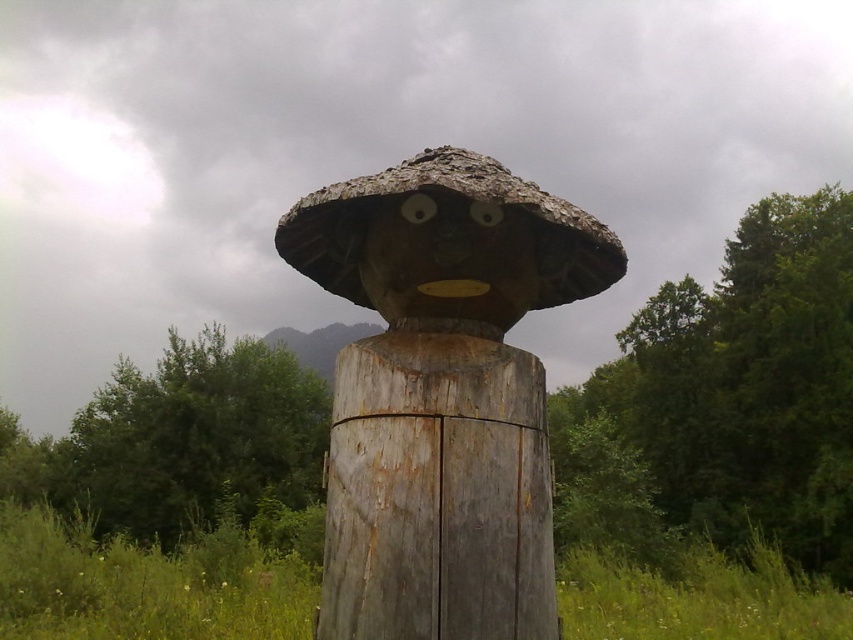
Question: Is rusty wood totem at center bigger than wooden sculpture at center?

Choices:
 (A) no
 (B) yes

Answer: (B)

Question: Which of the following is the farthest from the observer?

Choices:
 (A) (514, 236)
 (B) (496, 170)

Answer: (A)

Question: Which point is closer to the camera?

Choices:
 (A) weathered wood post at center
 (B) wooden sculpture at center
 (C) rusty wood totem at center

Answer: (B)

Question: Can you confirm if weathered wood post at center is positioned below wooden sculpture at center?

Choices:
 (A) no
 (B) yes

Answer: (B)

Question: Is rusty wood totem at center positioned in front of wooden sculpture at center?

Choices:
 (A) yes
 (B) no

Answer: (B)

Question: Which point appears farthest from the camera in this image?

Choices:
 (A) (457, 545)
 (B) (444, 337)

Answer: (B)